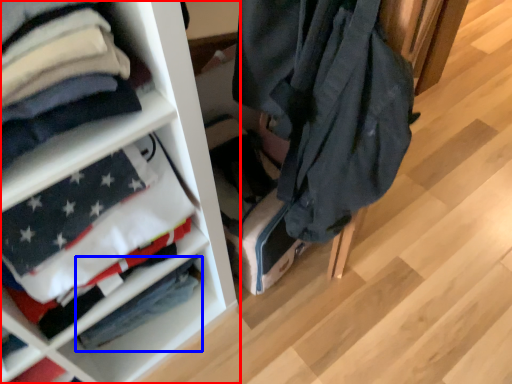
Question: Which of the following is the closest to the observer, shelf (highlighted by a red box) or flag (highlighted by a blue box)?

Choices:
 (A) shelf
 (B) flag

Answer: (A)